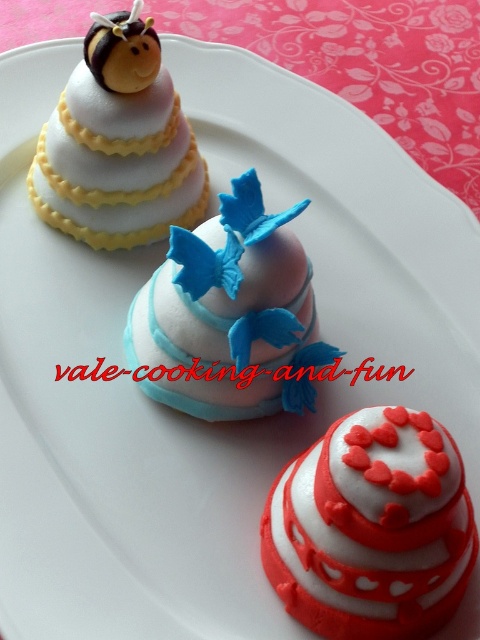
Question: Can you confirm if smooth white and red fondant cake at center is smaller than matte pink fondant cake at center?

Choices:
 (A) yes
 (B) no

Answer: (A)

Question: Which point is closer to the camera?

Choices:
 (A) (328, 352)
 (B) (134, 8)

Answer: (B)

Question: Which object appears closest to the camera in this image?

Choices:
 (A) matte pink fondant cake at center
 (B) smooth white and red fondant cake at center

Answer: (B)

Question: Can you confirm if matte pink fondant cake at center is thinner than matte white fondant cake at upper left?

Choices:
 (A) yes
 (B) no

Answer: (B)

Question: Observing the image, what is the correct spatial positioning of smooth white and red fondant cake at center in reference to matte white fondant cake at upper left?

Choices:
 (A) left
 (B) right

Answer: (B)

Question: Which object is positioned closest to the smooth white and red fondant cake at center?

Choices:
 (A) matte pink fondant cake at center
 (B) matte white fondant cake at upper left

Answer: (A)